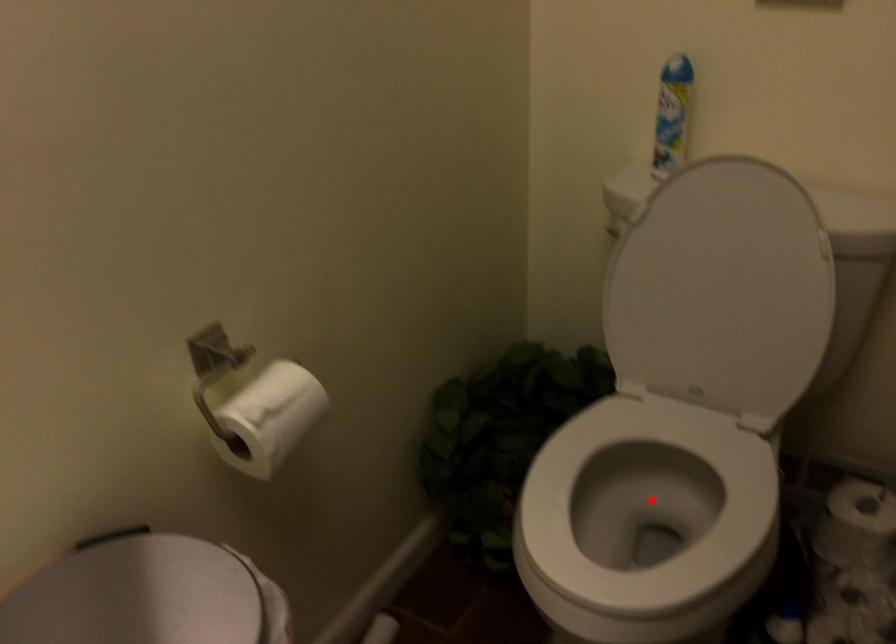
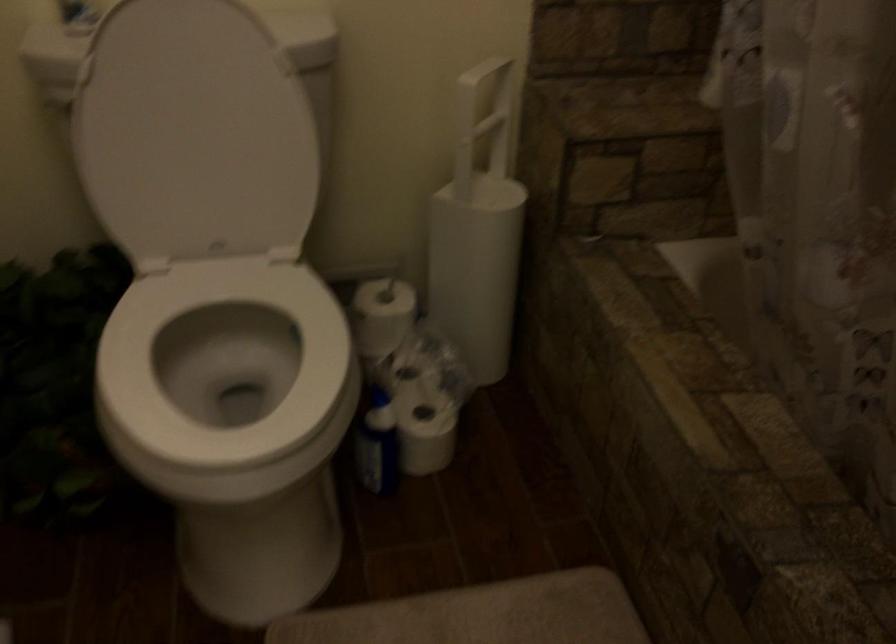
Find the pixel in the second image that matches the highlighted location in the first image.

(224, 365)